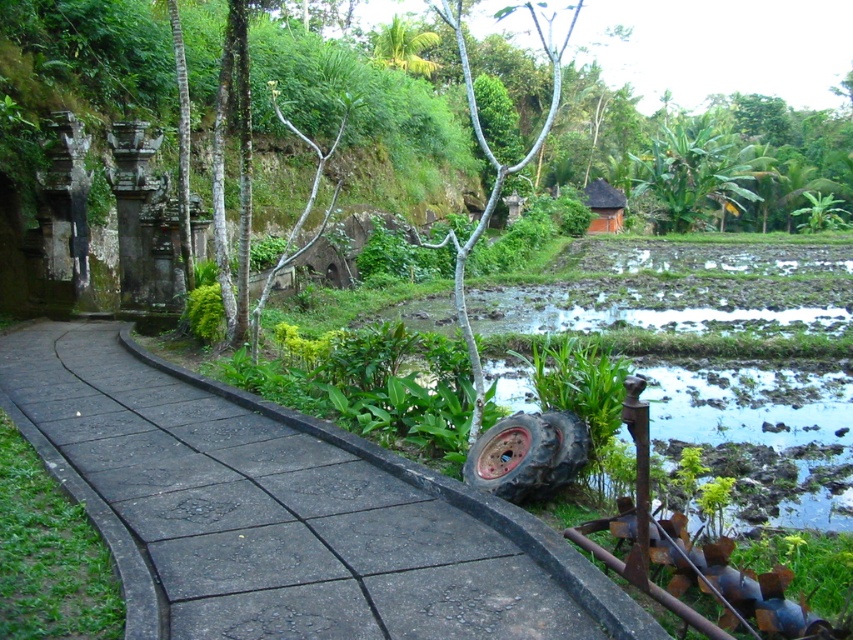
You are a delivery person with a cart that has a black rubber tire at lower right. You need to drive over the black concrete pavement at center. Will the cart be able to pass over it without getting stuck?

The black concrete pavement at center is not as tall as the black rubber tire at lower right, so the cart should be able to pass over it without getting stuck.

You are a traveler who needs to decide whether to place a small garden statue on the black rubber tire at lower right or the brown clay hut at upper center. Based on their sizes, which location would be more stable?

The black rubber tire at lower right is larger in size than the brown clay hut at upper center, so placing the garden statue on the black rubber tire at lower right would provide a more stable base.

You are a delivery person trying to park your vehicle near the brown clay hut at upper center. The black rubber tire at lower right is part of your vehicle. Since the tire is wider than the hut, will it fit without blocking the entrance?

The black rubber tire at lower right is wider than the brown clay hut at upper center, so parking the vehicle there would cause the tire to block the entrance of the hut.